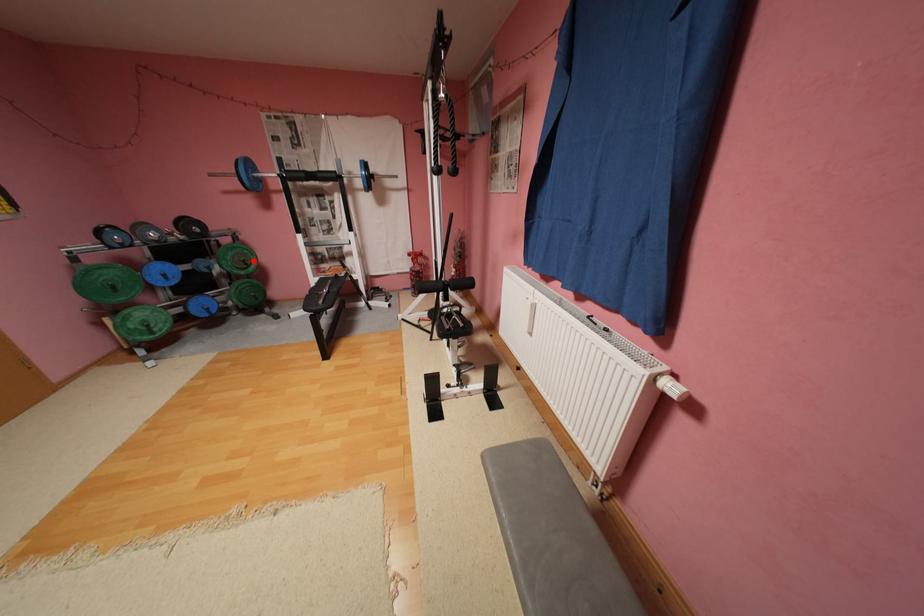
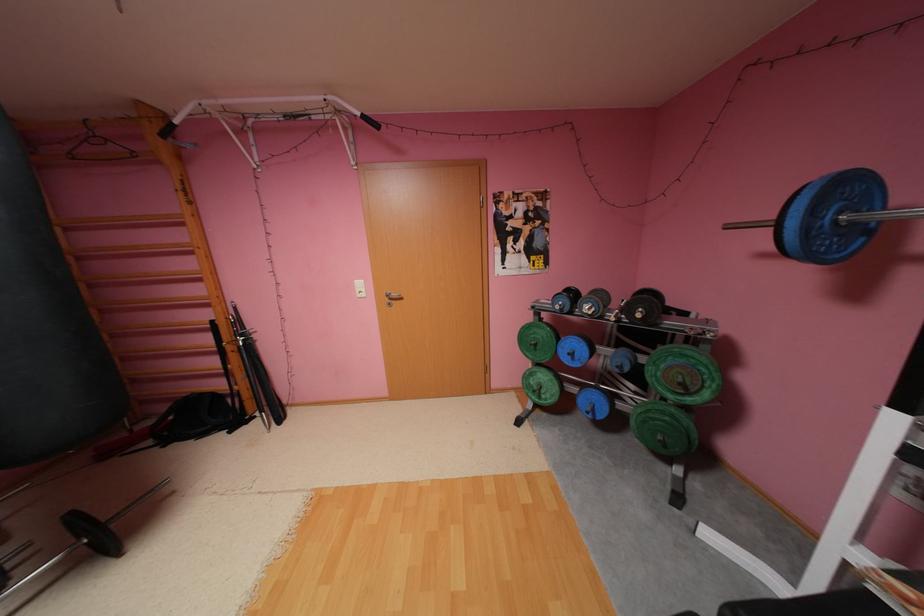
Locate, in the second image, the point that corresponds to the highlighted location in the first image.

(690, 384)